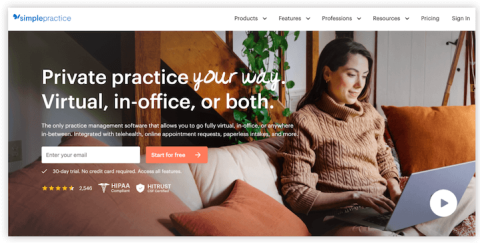
You are a GUI agent. You are given a task and a screenshot of the screen. Output one action in this format:
    pyautogui.click(x=<x>, y=<y>)
    Task: Click on the green plant cascading down the side of the stair railing vertically
    This screenshot has width=480, height=243.
    Given the screenshot: What is the action you would take?
    pyautogui.click(x=259, y=44)